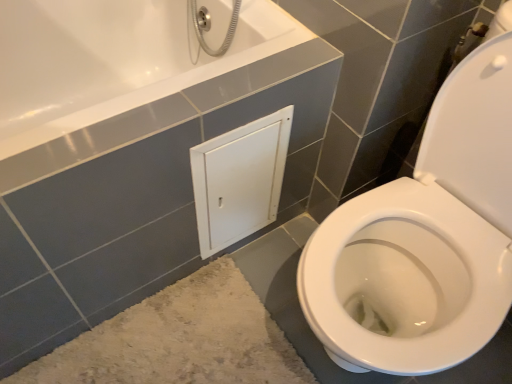
Question: Could you tell me if beige shaggy bath mat at lower left is turned towards white matte cabinet at center?

Choices:
 (A) yes
 (B) no

Answer: (B)

Question: Is beige shaggy bath mat at lower left wider than white matte cabinet at center?

Choices:
 (A) no
 (B) yes

Answer: (B)

Question: Considering the relative positions of beige shaggy bath mat at lower left and white matte cabinet at center in the image provided, is beige shaggy bath mat at lower left in front of white matte cabinet at center?

Choices:
 (A) yes
 (B) no

Answer: (A)

Question: Would you say beige shaggy bath mat at lower left contains white matte cabinet at center?

Choices:
 (A) no
 (B) yes

Answer: (A)

Question: Is beige shaggy bath mat at lower left at the left side of white matte cabinet at center?

Choices:
 (A) no
 (B) yes

Answer: (B)

Question: Is beige shaggy bath mat at lower left to the right of white matte cabinet at center from the viewer's perspective?

Choices:
 (A) yes
 (B) no

Answer: (B)

Question: Could you tell me if white matte cabinet at center is facing beige shaggy bath mat at lower left?

Choices:
 (A) yes
 (B) no

Answer: (B)

Question: Are white matte cabinet at center and beige shaggy bath mat at lower left located far from each other?

Choices:
 (A) yes
 (B) no

Answer: (B)

Question: Is white matte cabinet at center next to beige shaggy bath mat at lower left?

Choices:
 (A) yes
 (B) no

Answer: (B)

Question: Is white matte cabinet at center wider than beige shaggy bath mat at lower left?

Choices:
 (A) yes
 (B) no

Answer: (B)

Question: Can you confirm if white matte cabinet at center is smaller than beige shaggy bath mat at lower left?

Choices:
 (A) yes
 (B) no

Answer: (A)

Question: Does white matte cabinet at center have a greater height compared to beige shaggy bath mat at lower left?

Choices:
 (A) no
 (B) yes

Answer: (B)

Question: From their relative heights in the image, would you say white matte cabinet at center is taller or shorter than beige shaggy bath mat at lower left?

Choices:
 (A) tall
 (B) short

Answer: (A)